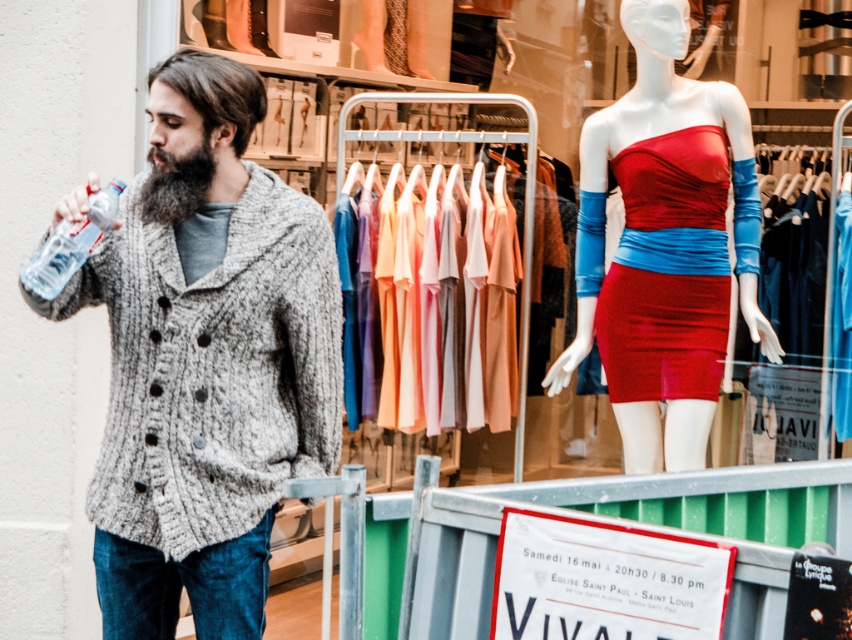
Which is more to the right, satin red dress at center or clear plastic bottle at left?

satin red dress at center

Does satin red dress at center have a greater height compared to clear plastic bottle at left?

Yes.

I want to click on satin red dress at center, so click(x=666, y=269).

Who is more distant from viewer, (246, 545) or (735, 240)?

The point (735, 240) is behind.

Does knitted gray cardigan at left have a lesser width compared to shiny red dress at center?

Correct, knitted gray cardigan at left's width is less than shiny red dress at center's.

Does point (245, 596) lie behind point (583, 168)?

No, (245, 596) is closer to viewer.

You are a GUI agent. You are given a task and a screenshot of the screen. Output one action in this format:
    pyautogui.click(x=<x>, y=<y>)
    Task: Click on the knitted gray cardigan at left
    The image size is (852, 640).
    Given the screenshot: What is the action you would take?
    pyautogui.click(x=206, y=369)

Which of these two, clear plastic bottle at left or dark brown fuzzy beard at left, stands taller?

clear plastic bottle at left is taller.

Is point (55, 275) positioned behind point (142, 195)?

No, (55, 275) is closer to viewer.

Find the location of `clear plastic bottle at left`. clear plastic bottle at left is located at coordinates (72, 243).